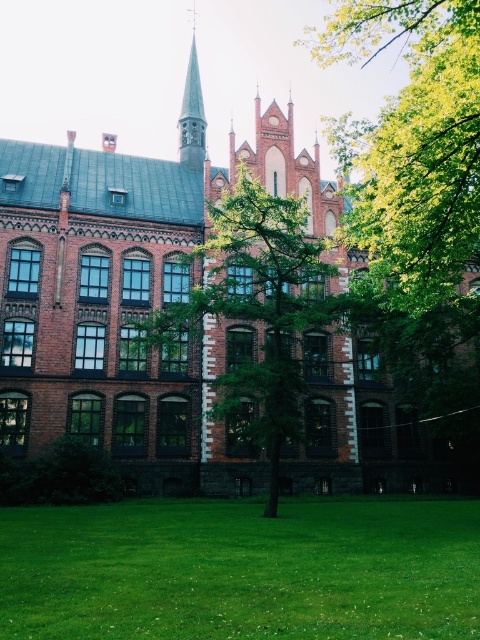
Is green grass at lower center thinner than smooth gray steeple at upper center?

In fact, green grass at lower center might be wider than smooth gray steeple at upper center.

Who is more forward, (228, 605) or (197, 84)?

Point (228, 605) is in front.

Is point (22, 570) behind point (190, 65)?

No, (22, 570) is closer to viewer.

Find the location of a particular element. The height and width of the screenshot is (640, 480). green grass at lower center is located at coordinates (241, 570).

Which is more to the right, green leafy tree at upper center or green leafy tree at center?

From the viewer's perspective, green leafy tree at upper center appears more on the right side.

Where is `green leafy tree at upper center`? Image resolution: width=480 pixels, height=640 pixels. green leafy tree at upper center is located at coordinates (411, 145).

The width and height of the screenshot is (480, 640). Identify the location of green leafy tree at upper center. (411, 145).

Does green grass at lower center have a lesser width compared to green leafy tree at center?

No, green grass at lower center is not thinner than green leafy tree at center.

Is point (367, 541) in front of point (283, 326)?

Yes, point (367, 541) is in front of point (283, 326).

This screenshot has width=480, height=640. In order to click on green grass at lower center in this screenshot , I will do `click(241, 570)`.

Where is `green grass at lower center`? Image resolution: width=480 pixels, height=640 pixels. green grass at lower center is located at coordinates (241, 570).